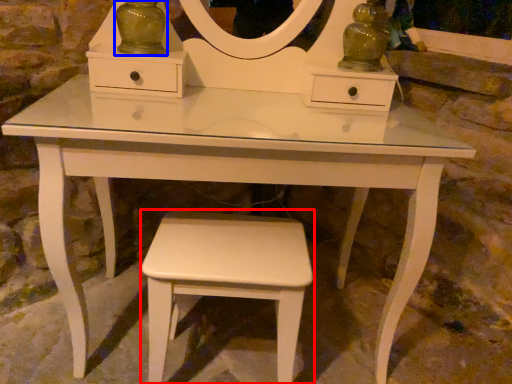
Question: Which object appears closest to the camera in this image, stool (highlighted by a red box) or glass vase (highlighted by a blue box)?

Choices:
 (A) stool
 (B) glass vase

Answer: (A)